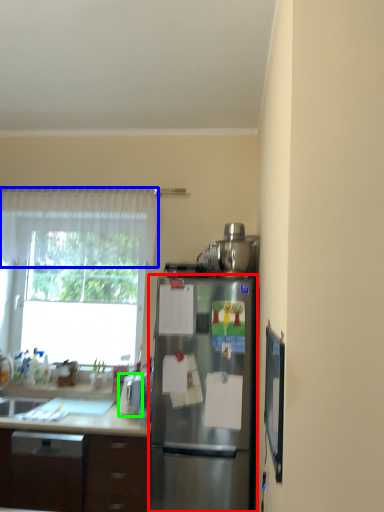
Question: Based on their relative distances, which object is farther from refrigerator (highlighted by a red box)? Choose from curtain (highlighted by a blue box) and appliance (highlighted by a green box).

Choices:
 (A) curtain
 (B) appliance

Answer: (A)